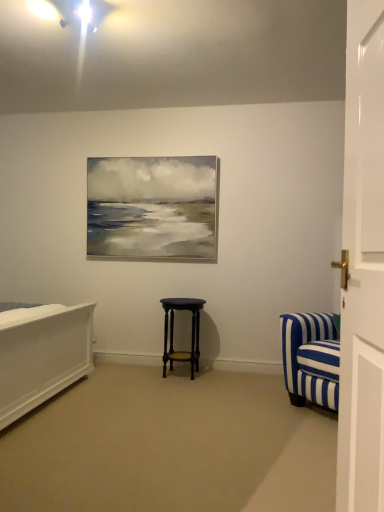
Measure the distance between white glossy door at right and camera.

The depth of white glossy door at right is 95.70 centimeters.

What do you see at coordinates (363, 267) in the screenshot? I see `white glossy door at right` at bounding box center [363, 267].

Identify the location of white glossy door at right. The width and height of the screenshot is (384, 512). (363, 267).

The width and height of the screenshot is (384, 512). What do you see at coordinates (173, 332) in the screenshot? I see `matte black stool at center` at bounding box center [173, 332].

This screenshot has height=512, width=384. Find the location of `matte black stool at center`. matte black stool at center is located at coordinates (173, 332).

Measure the distance between matte black stool at center and camera.

matte black stool at center and camera are 3.47 meters apart.

This screenshot has width=384, height=512. Identify the location of white glossy door at right. (363, 267).

Considering the relative positions of white glossy door at right and matte black stool at center in the image provided, is white glossy door at right to the left or to the right of matte black stool at center?

From the image, it's evident that white glossy door at right is to the right of matte black stool at center.

Considering the positions of objects white glossy door at right and matte black stool at center in the image provided, who is in front, white glossy door at right or matte black stool at center?

Positioned in front is white glossy door at right.

Is point (373, 158) farther from camera compared to point (169, 301)?

No, it is not.

From the image's perspective, is white glossy door at right on top of matte black stool at center?

Yes, from the image's perspective, white glossy door at right is on top of matte black stool at center.

From a real-world perspective, is white glossy door at right below matte black stool at center?

No, from a real-world perspective, white glossy door at right is not below matte black stool at center.

Which of these two, white glossy door at right or matte black stool at center, is thinner?

white glossy door at right.

Can you confirm if white glossy door at right is taller than matte black stool at center?

Yes, white glossy door at right is taller than matte black stool at center.

Which of these two, white glossy door at right or matte black stool at center, is smaller?

white glossy door at right.

Is white glossy door at right inside the boundaries of matte black stool at center, or outside?

white glossy door at right is not enclosed by matte black stool at center.

Is white glossy door at right far from matte black stool at center?

Yes, white glossy door at right and matte black stool at center are located far from each other.

Is white glossy door at right facing away from matte black stool at center?

No.

Measure the distance from white glossy door at right to matte black stool at center.

They are 7.86 feet apart.

The width and height of the screenshot is (384, 512). I want to click on door that is in front of the matte black stool at center, so click(363, 267).

Would you say matte black stool at center is to the left or to the right of white glossy door at right in the picture?

From the image, it's evident that matte black stool at center is to the left of white glossy door at right.

Which is in front, matte black stool at center or white glossy door at right?

Positioned in front is white glossy door at right.

Between point (192, 341) and point (365, 273), which one is positioned behind?

The point (192, 341) is farther from the camera.

From the image's perspective, does matte black stool at center appear higher than white glossy door at right?

No.

From a real-world perspective, relative to white glossy door at right, is matte black stool at center vertically above or below?

From a real-world perspective, matte black stool at center is physically below white glossy door at right.

Is matte black stool at center thinner than white glossy door at right?

No, matte black stool at center is not thinner than white glossy door at right.

Which of these two, matte black stool at center or white glossy door at right, stands taller?

With more height is white glossy door at right.

Which of these two, matte black stool at center or white glossy door at right, is smaller?

white glossy door at right.

Is matte black stool at center inside or outside of white glossy door at right?

matte black stool at center exists outside the volume of white glossy door at right.

Is matte black stool at center far away from white glossy door at right?

Indeed, matte black stool at center is not near white glossy door at right.

Does matte black stool at center turn towards white glossy door at right?

No, matte black stool at center is not facing towards white glossy door at right.

Measure the distance between matte black stool at center and white glossy door at right.

matte black stool at center and white glossy door at right are 2.40 meters apart.

The image size is (384, 512). I want to click on door above the matte black stool at center (from the image's perspective), so click(363, 267).

I want to click on door in front of the matte black stool at center, so click(x=363, y=267).

The image size is (384, 512). Identify the location of door located above the matte black stool at center (from a real-world perspective). (363, 267).